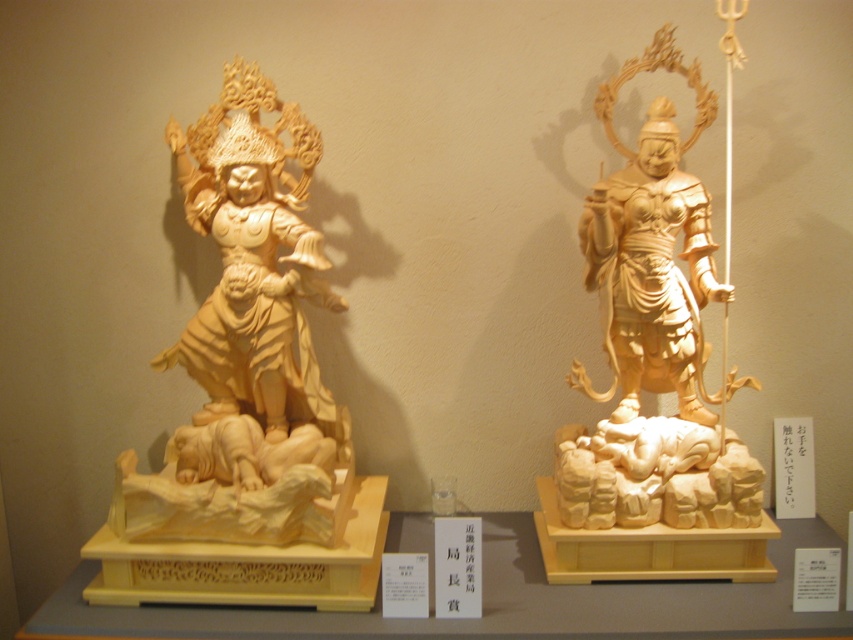
Question: Which of the following is the farthest from the observer?

Choices:
 (A) (631, 220)
 (B) (131, 529)

Answer: (A)

Question: Is light wood statue at center in front of light wood statue at right?

Choices:
 (A) no
 (B) yes

Answer: (A)

Question: Can you confirm if light wood statue at center is positioned to the right of light wood statue at right?

Choices:
 (A) yes
 (B) no

Answer: (A)

Question: Which of the following is the closest to the observer?

Choices:
 (A) light wood statue at center
 (B) light wood statue at left
 (C) light wood statue at right

Answer: (B)

Question: Which is nearer to the light wood statue at center?

Choices:
 (A) light wood statue at left
 (B) light wood statue at right

Answer: (B)

Question: Can you confirm if light wood statue at center is bigger than light wood statue at right?

Choices:
 (A) no
 (B) yes

Answer: (B)